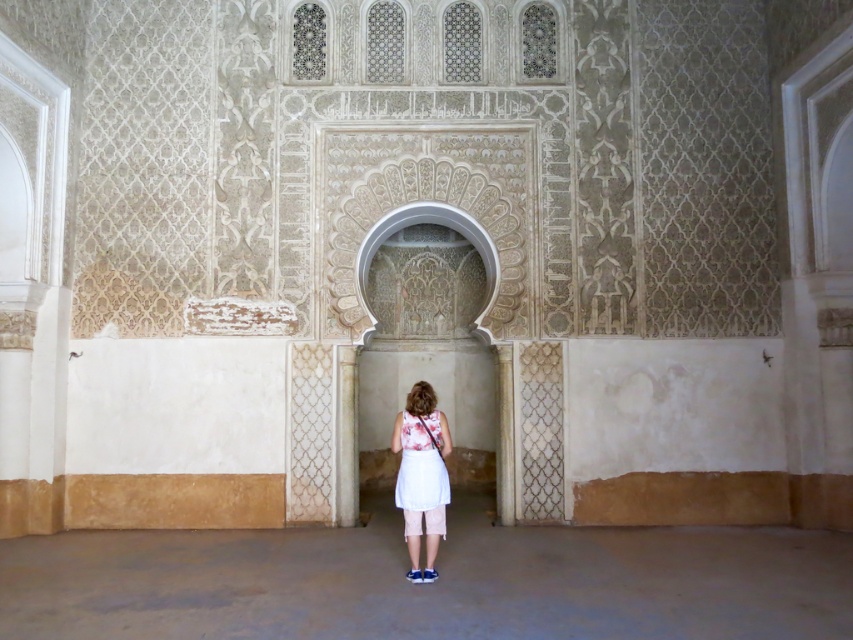
Between white cotton skirt at center and white cotton dress at center, which one appears on the right side from the viewer's perspective?

Positioned to the right is white cotton dress at center.

Who is more forward, [426,499] or [430,426]?

Point [426,499] is more forward.

Find the location of a particular element. The width and height of the screenshot is (853, 640). white cotton skirt at center is located at coordinates (421, 476).

Is point (427, 420) more distant than point (373, 244)?

No, it is in front of (373, 244).

Image resolution: width=853 pixels, height=640 pixels. Describe the element at coordinates (421, 476) in the screenshot. I see `white cotton skirt at center` at that location.

What do you see at coordinates (421, 476) in the screenshot? The height and width of the screenshot is (640, 853). I see `white cotton skirt at center` at bounding box center [421, 476].

The image size is (853, 640). I want to click on white cotton skirt at center, so click(421, 476).

Measure the distance between point [410,419] and camera.

A distance of 6.54 meters exists between point [410,419] and camera.

Can you confirm if white cotton skirt at center is positioned above white textured pillar at lower center?

No, white cotton skirt at center is not above white textured pillar at lower center.

Is point (432, 556) closer to camera compared to point (352, 518)?

Yes, it is in front of point (352, 518).

At what (x,y) coordinates should I click in order to perform the action: click on white cotton skirt at center. Please return your answer as a coordinate pair (x, y). Looking at the image, I should click on (421, 476).